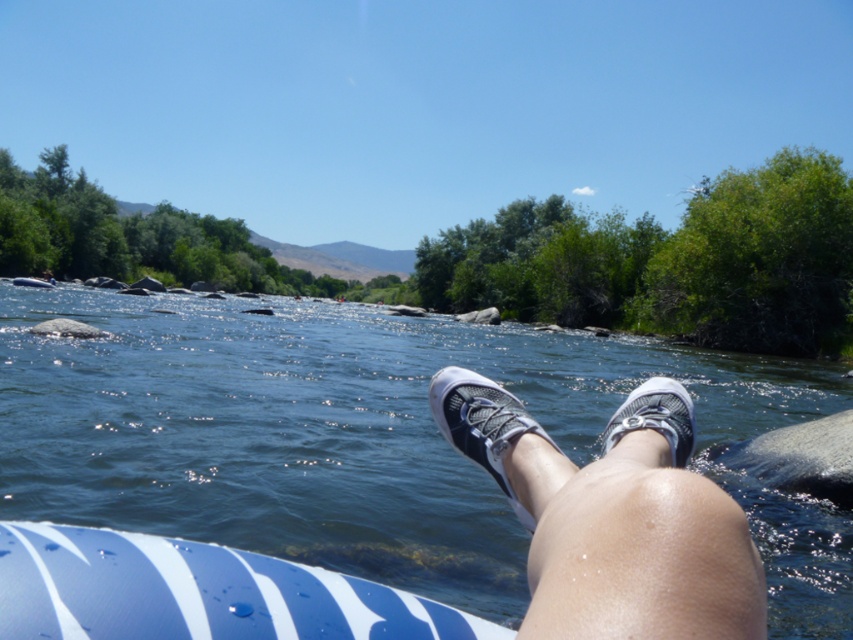
You are standing on the riverbank and notice a gray smooth rock at lower right. What is the location of the point with coordinates (798,458) in relation to the gray smooth rock at lower right?

The point with coordinates (798,458) is located on the gray smooth rock at lower right.

You are standing on the riverbank and want to place both the blue striped board at lower left and the white mesh shoe at lower center onto a 1.2 meter long floating platform. Based on their sizes, will both items fit side by side on the platform?

The blue striped board at lower left is shorter than the white mesh shoe at lower center. However, without knowing their exact lengths, we cannot determine if their combined length exceeds 1.2 meters. More information is needed.

You are a photographer aiming to capture a closeup of the blue striped board at lower left and the white mesh shoe at lower center in the image. Given that your camera can focus on objects within a 28 inch range, will you be able to capture both in focus without adjusting your position?

The blue striped board at lower left and white mesh shoe at lower center are 29.20 inches apart. Since the camera can only focus within a 28 inch range, the distance between them exceeds the focus range. Therefore, you cannot capture both in focus without moving closer or adjusting your position.